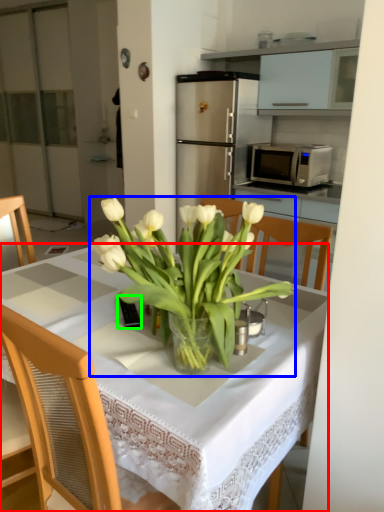
Question: Which is nearer to the desk (highlighted by a red box)? flower (highlighted by a blue box) or corded phone (highlighted by a green box).

Choices:
 (A) flower
 (B) corded phone

Answer: (A)